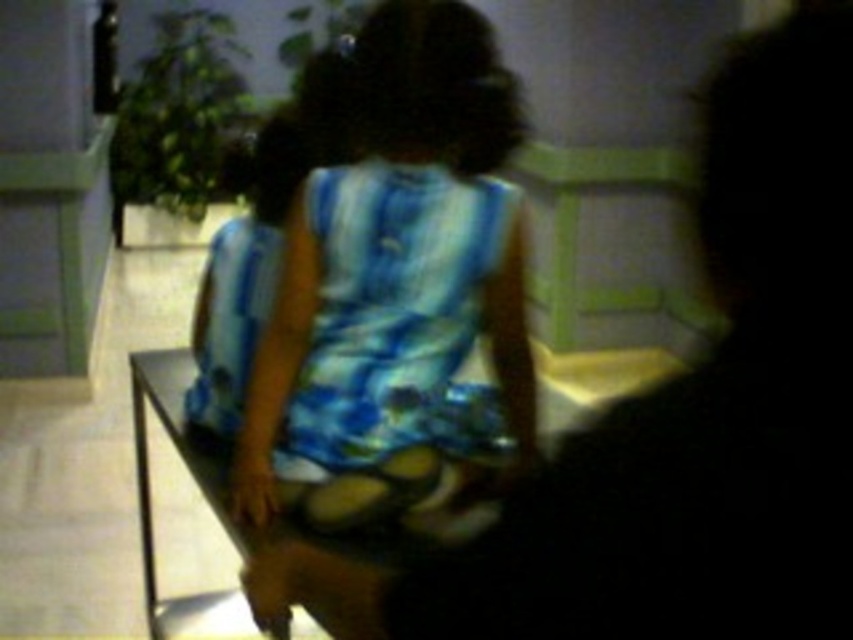
Question: Which of the following is the closest to the observer?

Choices:
 (A) (340, 248)
 (B) (434, 241)

Answer: (A)

Question: Can you confirm if blue tie-dye dress at center is bigger than blue tie-dye fabric dress at center?

Choices:
 (A) yes
 (B) no

Answer: (A)

Question: Which of the following is the farthest from the observer?

Choices:
 (A) (589, 560)
 (B) (282, 257)
 (C) (381, 333)

Answer: (B)

Question: Is the position of blue printed dress at center more distant than that of blue tie-dye fabric dress at center?

Choices:
 (A) yes
 (B) no

Answer: (B)

Question: Can you confirm if blue printed dress at center is wider than blue tie-dye fabric dress at center?

Choices:
 (A) no
 (B) yes

Answer: (B)

Question: Which point is farther from the camera taking this photo?

Choices:
 (A) 366,476
 (B) 509,516
 (C) 318,300

Answer: (C)